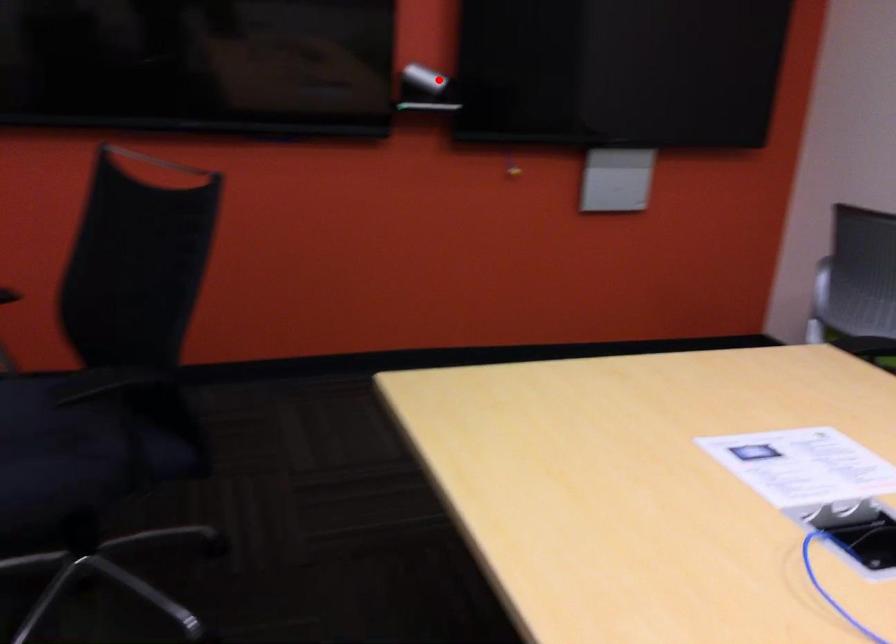
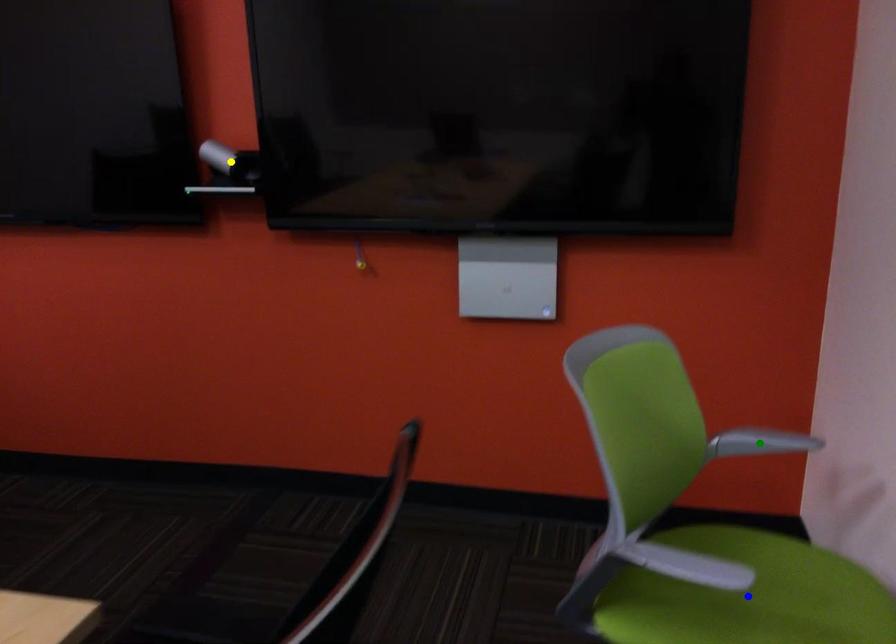
Question: I am providing you with two images of the same scene from different viewpoints. A red point is marked on the first image. You are given multiple points on the second image. Which point in image 2 represents the same 3d spot as the red point in image 1?

Choices:
 (A) green point
 (B) blue point
 (C) yellow point

Answer: (C)